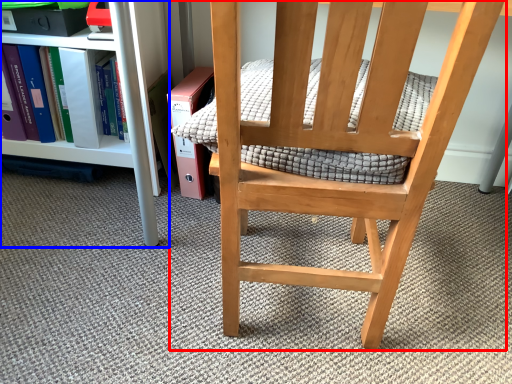
Question: Which point is closer to the camera, chair (highlighted by a red box) or shelf (highlighted by a blue box)?

Choices:
 (A) chair
 (B) shelf

Answer: (A)